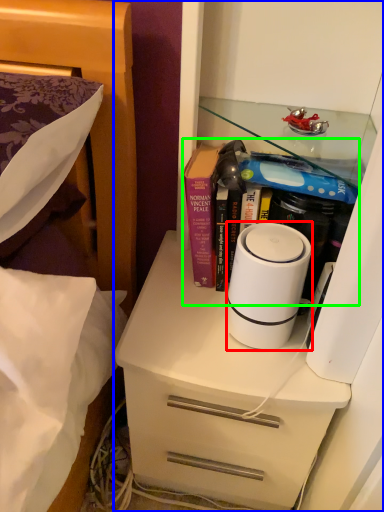
Question: Which object is the closest to the home appliance (highlighted by a red box)? Choose among these: cabinetry (highlighted by a blue box) or book (highlighted by a green box).

Choices:
 (A) cabinetry
 (B) book

Answer: (B)